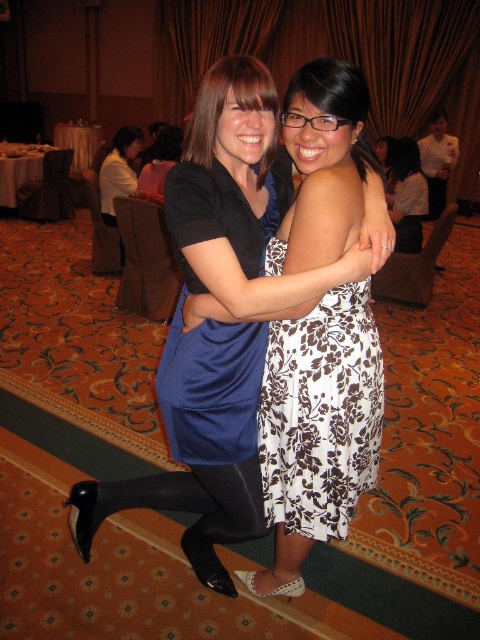
Question: Where is white floral dress at center located in relation to floral dress at center in the image?

Choices:
 (A) right
 (B) left

Answer: (B)

Question: Which point appears farthest from the camera in this image?

Choices:
 (A) (262, 339)
 (B) (408, 145)

Answer: (B)

Question: Which point appears closest to the camera in this image?

Choices:
 (A) (330, 67)
 (B) (239, 209)
 (C) (123, 173)
 (D) (453, 164)

Answer: (A)

Question: Is blue satin dress at center wider than floral dress at center?

Choices:
 (A) yes
 (B) no

Answer: (A)

Question: Which point is farther from the camera taking this photo?

Choices:
 (A) (402, 243)
 (B) (309, 352)

Answer: (A)

Question: Is matte blue dress at center smaller than matte black dress at upper left?

Choices:
 (A) no
 (B) yes

Answer: (B)